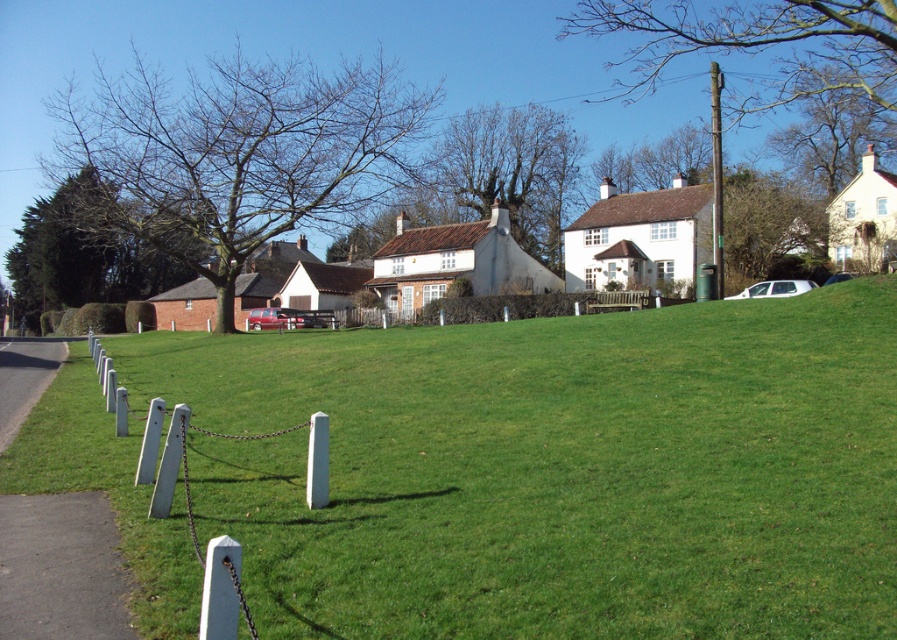
You are standing at the origin point of the image coordinates. You want to walk to the green grass at center. In which direction should you move?

Since the green grass at center is located at coordinates point (556, 470), you should move towards the right and upward direction from your current position at the origin to reach it.

You are standing at the edge of the road and want to walk to the green grass at center. Is the metallic silver car at center blocking your path?

The green grass at center is closer to the viewer than the metallic silver car at center, so the metallic silver car at center is behind the green grass at center and not blocking the path.

You are a gardener planning to install a new fence post between the green grass at center and the green metallic pole at upper right. Which object should you place the post closer to to ensure it doesn

The green grass at center has a lesser width compared to the green metallic pole at upper right. Therefore, the new fence post should be placed closer to the green grass at center to maintain proper spacing between the two objects.